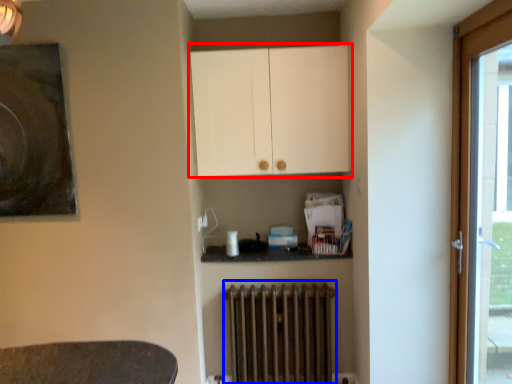
Question: Which of the following is the closest to the observer, cabinetry (highlighted by a red box) or radiator (highlighted by a blue box)?

Choices:
 (A) cabinetry
 (B) radiator

Answer: (A)